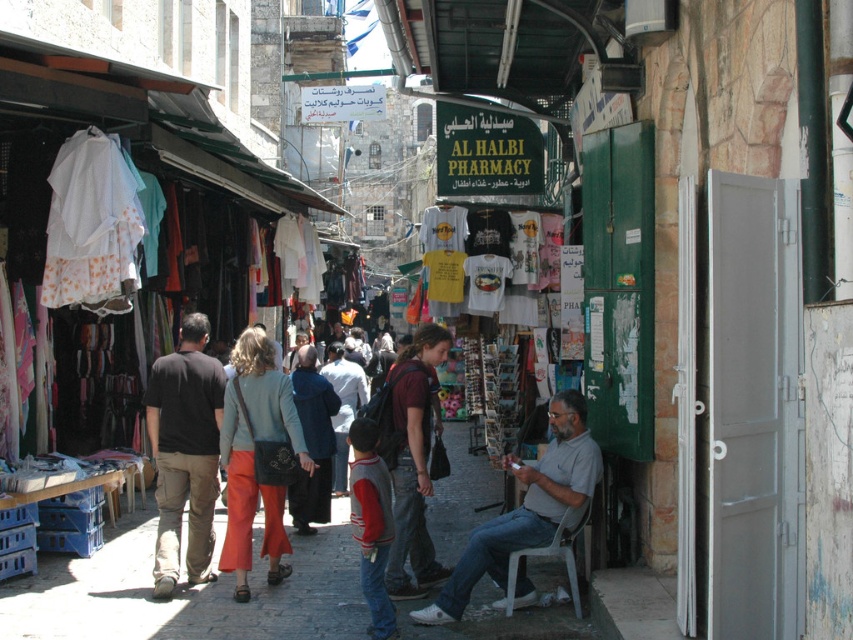
Question: Based on their relative distances, which object is nearer to the black cotton shirt at left?

Choices:
 (A) light brown leather jacket at center
 (B) gray fabric shirt at lower right

Answer: (B)

Question: In this image, where is black cotton shirt at left located relative to light brown leather jacket at center?

Choices:
 (A) left
 (B) right

Answer: (A)

Question: Among these objects, which one is nearest to the camera?

Choices:
 (A) light brown leather jacket at center
 (B) gray fabric shirt at lower right
 (C) black cotton shirt at left

Answer: (B)

Question: In this image, where is black cotton shirt at left located relative to gray fabric shirt at lower right?

Choices:
 (A) right
 (B) left

Answer: (B)

Question: Which point is farther to the camera?

Choices:
 (A) (535, 497)
 (B) (341, 461)
 (C) (177, 516)

Answer: (B)

Question: Does black cotton shirt at left appear under light brown leather jacket at center?

Choices:
 (A) no
 (B) yes

Answer: (A)